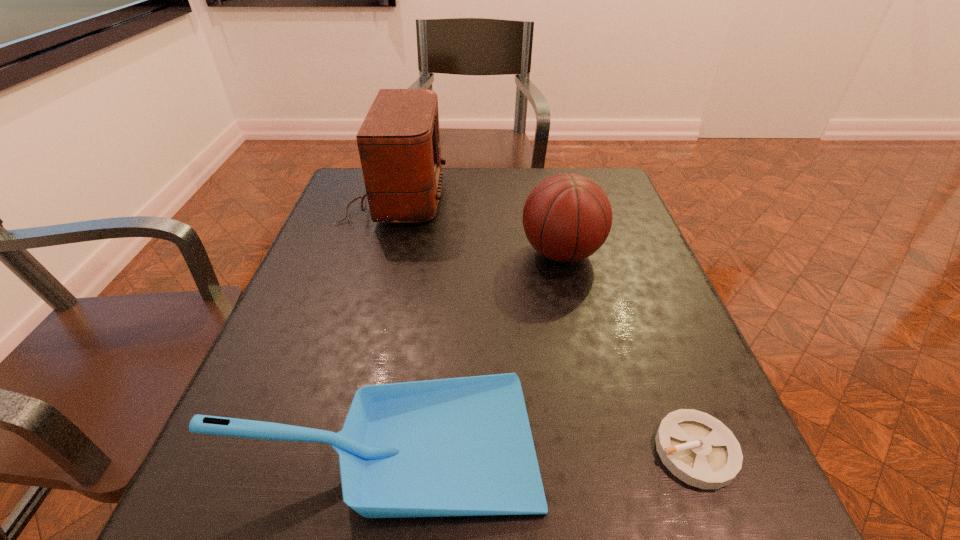
This screenshot has height=540, width=960. Identify the location of empty space that is in between the shortest object and the dustpan. (542, 446).

This screenshot has width=960, height=540. What are the coordinates of `vacant space that is in between the farthest object and the dustpan` in the screenshot? It's located at (393, 319).

This screenshot has height=540, width=960. Find the location of `free space between the basketball and the ashtray`. free space between the basketball and the ashtray is located at coordinates (629, 352).

Locate an element on the screen. The image size is (960, 540). the third closest object to the third tallest object is located at coordinates (399, 146).

Identify which object is the third nearest to the basketball. Please provide its 2D coordinates. Your answer should be formatted as a tuple, i.e. [(x, y)], where the tuple contains the x and y coordinates of a point satisfying the conditions above.

[(697, 448)]

This screenshot has width=960, height=540. Identify the location of vacant space that satisfies the following two spatial constraints: 1. on the back side of the basketball; 2. on the left side of the dustpan. (420, 253).

Identify the location of free location that satisfies the following two spatial constraints: 1. on the front side of the ashtray; 2. on the left side of the dustpan. (388, 451).

In order to click on free location that satisfies the following two spatial constraints: 1. on the front panel of the tallest object; 2. on the left side of the dustpan in this screenshot , I will do `click(328, 441)`.

Where is `vacant area that satisfies the following two spatial constraints: 1. on the front panel of the second shortest object; 2. on the right side of the tallest object`? vacant area that satisfies the following two spatial constraints: 1. on the front panel of the second shortest object; 2. on the right side of the tallest object is located at coordinates (328, 441).

Where is `vacant space that satisfies the following two spatial constraints: 1. on the front panel of the radio receiver; 2. on the right side of the third nearest object`? This screenshot has width=960, height=540. vacant space that satisfies the following two spatial constraints: 1. on the front panel of the radio receiver; 2. on the right side of the third nearest object is located at coordinates coord(380,253).